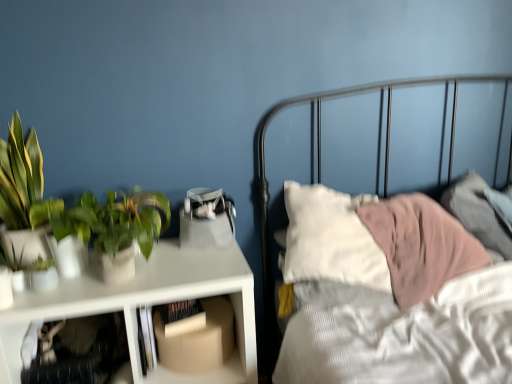
This screenshot has width=512, height=384. In order to click on free space above cardboard box at lower center, positioned as the first shelf in right-to-left order (from a real-world perspective) in this screenshot , I will do `click(197, 309)`.